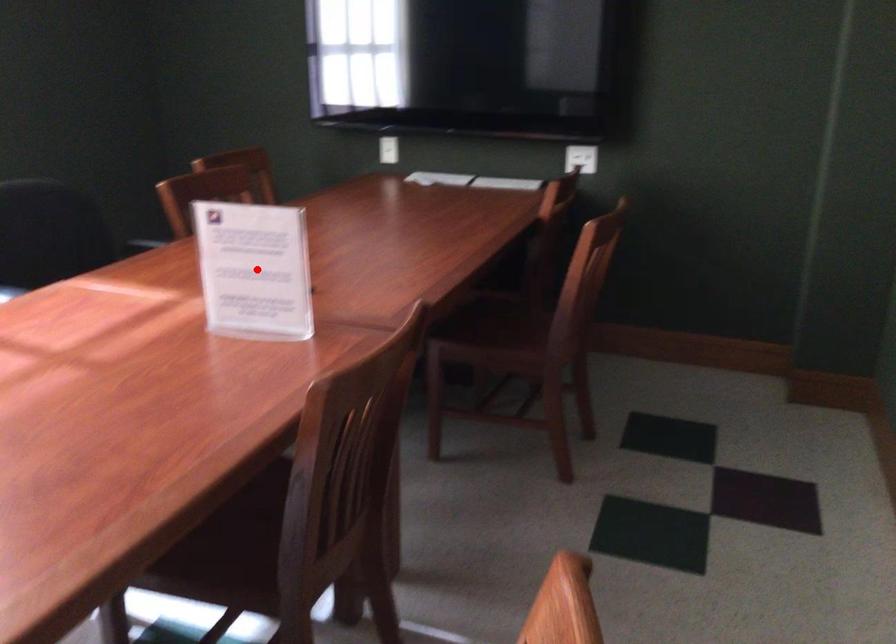
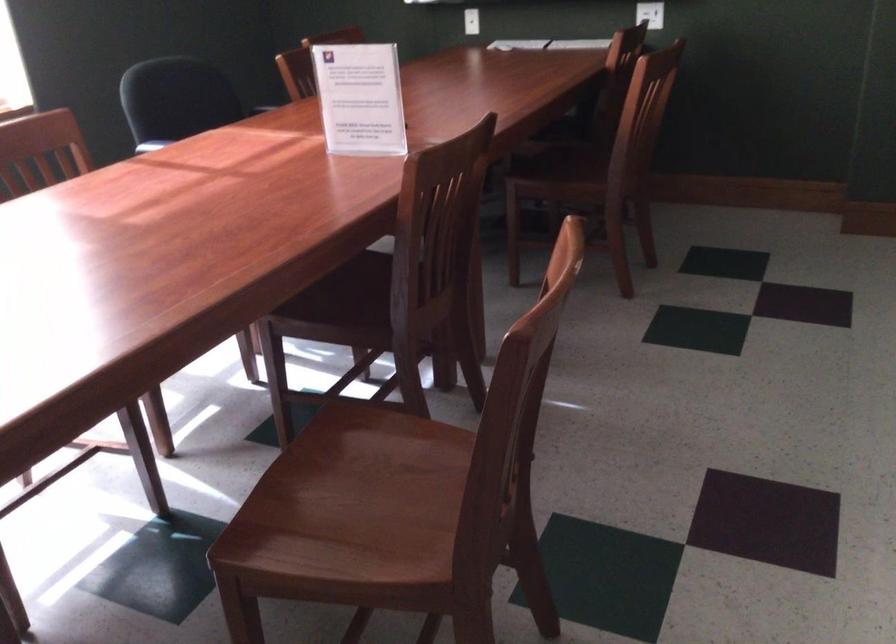
In the second image, find the point that corresponds to the highlighted location in the first image.

(359, 98)